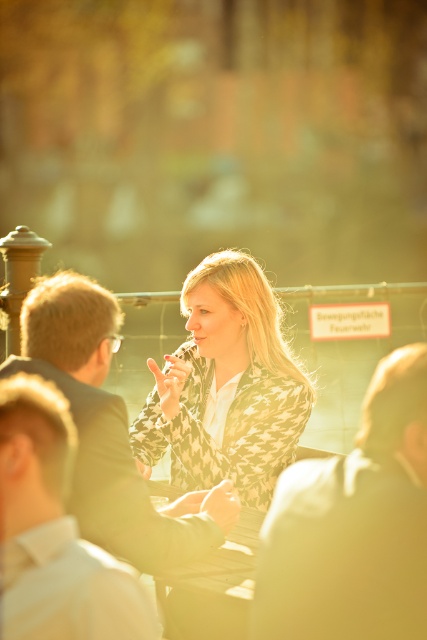
Between point (131, 480) and point (61, 532), which one is positioned in front?

Point (61, 532) is in front.

Is point (84, 276) less distant than point (52, 520)?

That is False.

Describe the element at coordinates (110, 432) in the screenshot. Image resolution: width=427 pixels, height=640 pixels. I see `matte black suit at center` at that location.

This screenshot has height=640, width=427. Identify the location of matte black suit at center. (110, 432).

Measure the distance between patterned fabric jacket at center and camera.

The distance of patterned fabric jacket at center from camera is 10.89 feet.

Can you confirm if patterned fabric jacket at center is smaller than green matte table at center?

No, patterned fabric jacket at center is not smaller than green matte table at center.

Where is `patterned fabric jacket at center`? patterned fabric jacket at center is located at coordinates (225, 387).

Find the location of a particular element. The width and height of the screenshot is (427, 640). patterned fabric jacket at center is located at coordinates (225, 387).

The image size is (427, 640). Describe the element at coordinates (353, 525) in the screenshot. I see `dark suit jacket at center` at that location.

Locate an element on the screen. The width and height of the screenshot is (427, 640). dark suit jacket at center is located at coordinates (353, 525).